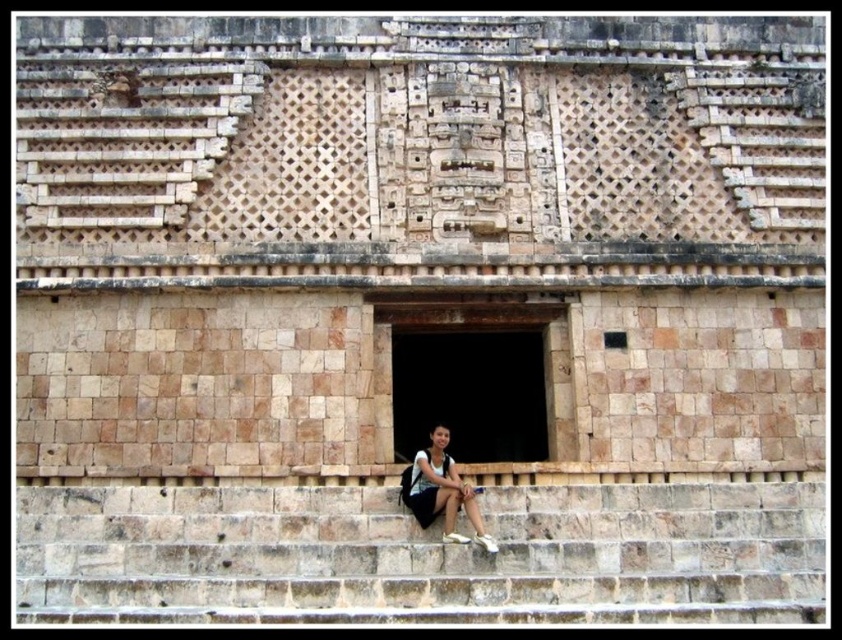
Who is positioned more to the right, brown stone stairs at lower center or matte black backpack at lower center?

matte black backpack at lower center is more to the right.

Where is `brown stone stairs at lower center`? brown stone stairs at lower center is located at coordinates (421, 554).

Image resolution: width=842 pixels, height=640 pixels. I want to click on brown stone stairs at lower center, so click(x=421, y=554).